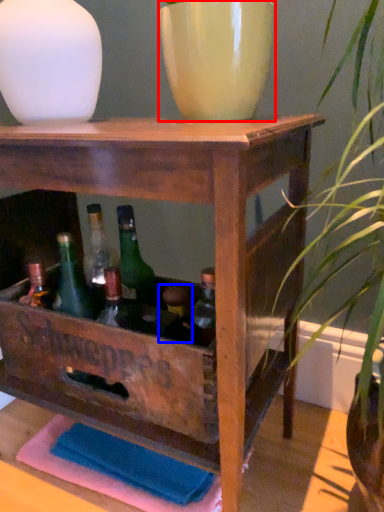
Question: Which point is closer to the camera, flowerpot (highlighted by a red box) or bottle (highlighted by a blue box)?

Choices:
 (A) flowerpot
 (B) bottle

Answer: (A)